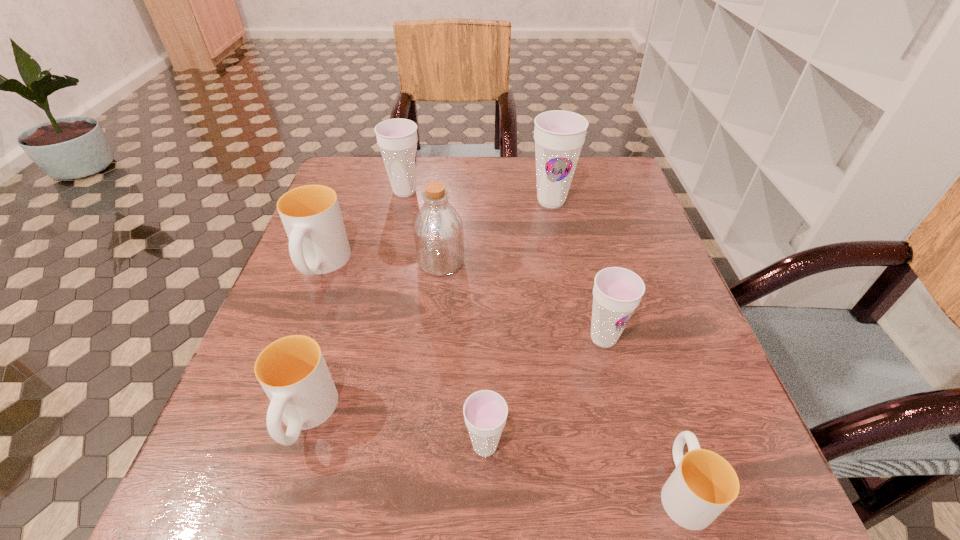
Where is `the smallest purple cup`? This screenshot has height=540, width=960. the smallest purple cup is located at coordinates (485, 412).

The height and width of the screenshot is (540, 960). Identify the location of the shortest object. (703, 484).

Where is `the smallest yellow cup`? The image size is (960, 540). the smallest yellow cup is located at coordinates (703, 484).

Locate an element on the screen. vacant space positioned 0.080m on the left of the biggest purple cup is located at coordinates (496, 201).

Where is `vacant space positioned on the right of the bottle`? This screenshot has height=540, width=960. vacant space positioned on the right of the bottle is located at coordinates (487, 262).

At what (x,y) coordinates should I click in order to perform the action: click on vacant region located 0.050m on the right of the second biggest purple cup. Please return your answer as a coordinate pair (x, y). The image size is (960, 540). Looking at the image, I should click on (443, 191).

Where is `blank space located with the handle on the side of the third farthest cup`? The width and height of the screenshot is (960, 540). blank space located with the handle on the side of the third farthest cup is located at coordinates (230, 503).

Where is `vacant region located 0.220m on the back of the third biggest purple cup`? vacant region located 0.220m on the back of the third biggest purple cup is located at coordinates (581, 248).

Locate an element on the screen. vacant space located with the handle on the side of the second biggest yellow cup is located at coordinates (277, 505).

Find the location of a particular element. This screenshot has height=540, width=960. vacant space located 0.260m on the right of the fourth object from right to left is located at coordinates (675, 446).